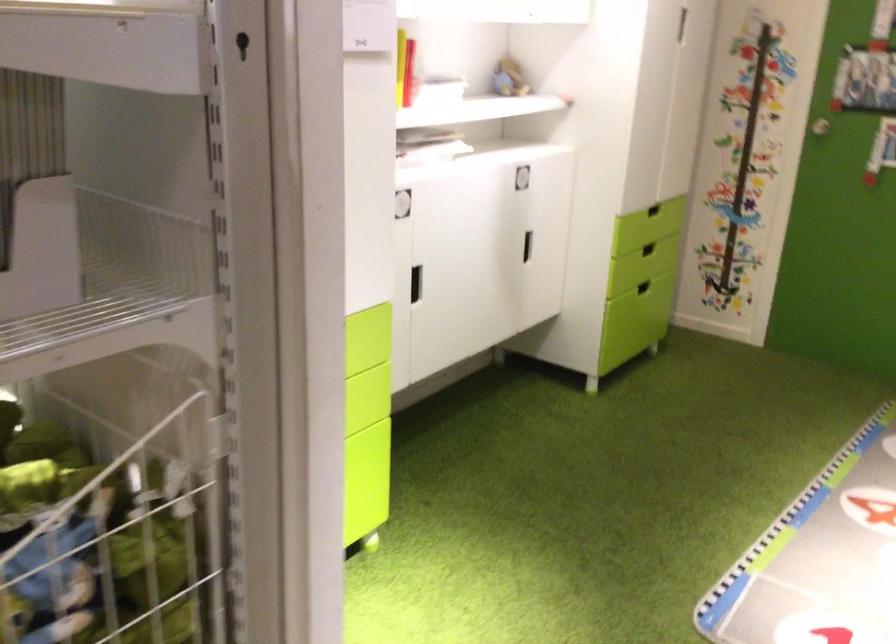
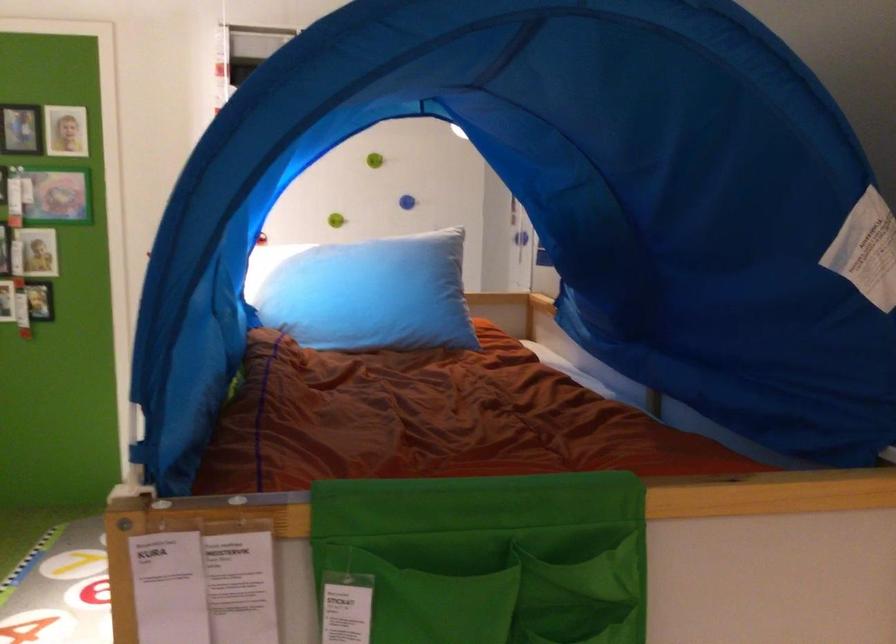
Question: The camera is either moving clockwise (left) or counter-clockwise (right) around the object. The first image is from the beginning of the video and the second image is from the end. Is the camera moving left or right when shooting the video?

Choices:
 (A) Left
 (B) Right

Answer: (A)